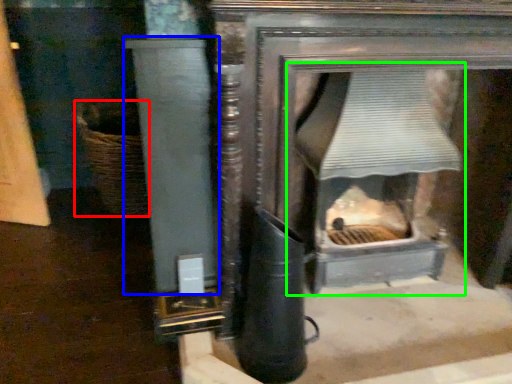
Question: Based on their relative distances, which object is farther from basket (highlighted by a red box)? Choose from pillar (highlighted by a blue box) and fireplace (highlighted by a green box).

Choices:
 (A) pillar
 (B) fireplace

Answer: (B)